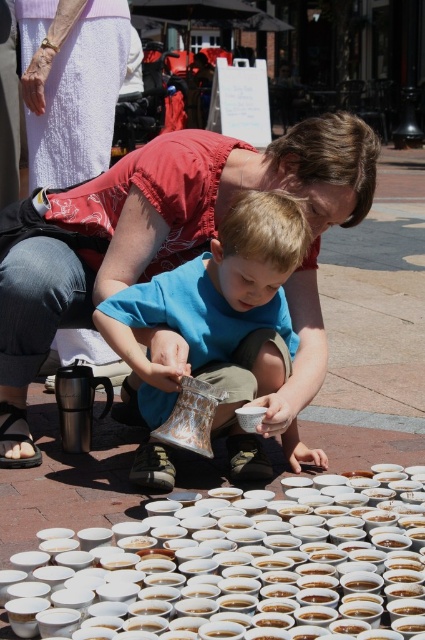
Between matte plastic bag at center and white matte cups at lower center, which one has more height?

With more height is matte plastic bag at center.

Between matte plastic bag at center and white matte cups at lower center, which one appears on the right side from the viewer's perspective?

Positioned to the right is white matte cups at lower center.

Does point (204, 157) lie behind point (246, 582)?

Yes, point (204, 157) is behind point (246, 582).

Where is `matte plastic bag at center`? The image size is (425, 640). matte plastic bag at center is located at coordinates (169, 244).

Who is more distant from viewer, (263,218) or (101,156)?

The point (101,156) is behind.

Which is below, blue cotton shirt at center or white textured skirt at upper left?

blue cotton shirt at center is below.

You are a GUI agent. You are given a task and a screenshot of the screen. Output one action in this format:
    pyautogui.click(x=<x>, y=<y>)
    Task: Click on the blue cotton shirt at center
    This screenshot has height=640, width=425.
    Given the screenshot: What is the action you would take?
    pyautogui.click(x=220, y=317)

Between white matte cups at lower center and blue cotton shirt at center, which one appears on the left side from the viewer's perspective?

blue cotton shirt at center

Where is `white matte cups at lower center`? Image resolution: width=425 pixels, height=640 pixels. white matte cups at lower center is located at coordinates (238, 563).

This screenshot has height=640, width=425. I want to click on white matte cups at lower center, so click(x=238, y=563).